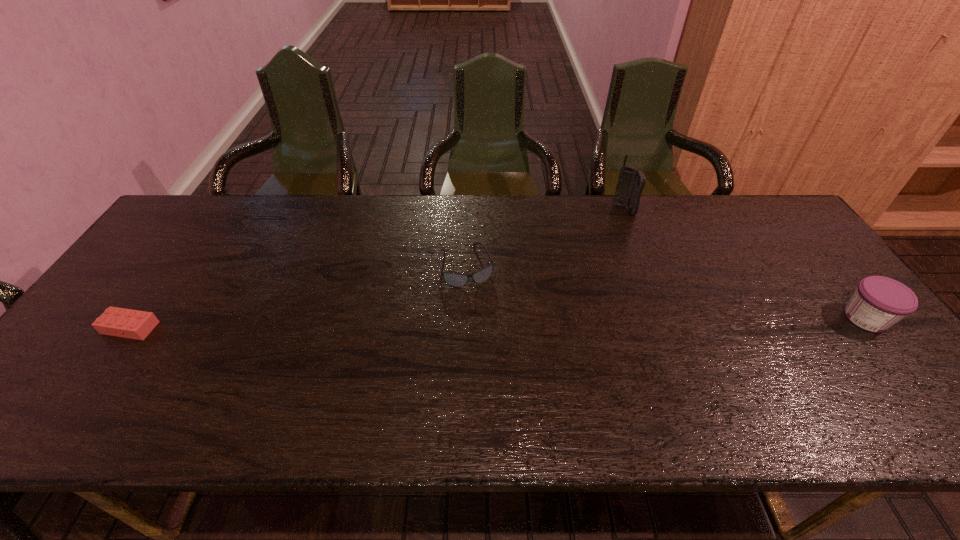
You are a GUI agent. You are given a task and a screenshot of the screen. Output one action in this format:
    pyautogui.click(x=<x>, y=<y>)
    Task: Click on the vacant space located on the lenses of the second object from left to right
    This screenshot has height=540, width=960.
    Given the screenshot: What is the action you would take?
    pyautogui.click(x=497, y=363)

Where is `vacant region located on the lenses of the second object from left to right`? vacant region located on the lenses of the second object from left to right is located at coordinates (492, 349).

What are the coordinates of `free space located on the keyboard of the third object from left to right` in the screenshot? It's located at (584, 297).

Find the location of a particular element. Image resolution: width=960 pixels, height=540 pixels. vacant space located on the keyboard of the third object from left to right is located at coordinates (614, 232).

The width and height of the screenshot is (960, 540). I want to click on vacant space situated on the keyboard of the third object from left to right, so click(x=603, y=256).

In order to click on object present at the far edge in this screenshot , I will do `click(631, 182)`.

Identify the location of object located at the left edge. (134, 324).

In order to click on object present at the right edge in this screenshot , I will do `click(878, 303)`.

Find the location of a particular element. Image resolution: width=960 pixels, height=540 pixels. vacant point at the far edge is located at coordinates (683, 226).

The height and width of the screenshot is (540, 960). In the image, there is a desktop. What are the coordinates of `vacant space at the near edge` in the screenshot? It's located at (203, 364).